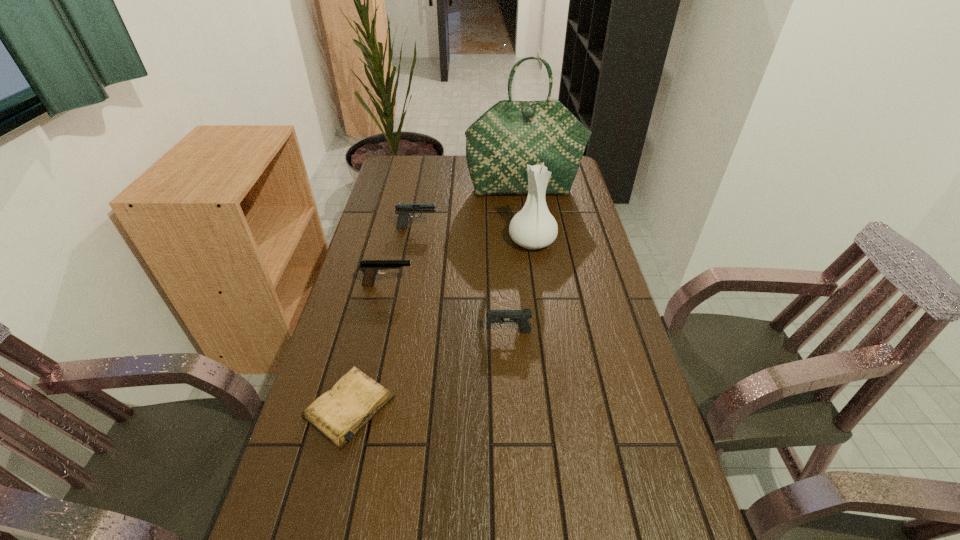
Locate an element on the screen. The image size is (960, 540). vacant space located on the back of the second tallest object is located at coordinates pyautogui.click(x=526, y=201).

Locate an element on the screen. The height and width of the screenshot is (540, 960). free space located aim along the barrel of the farthest pistol is located at coordinates (499, 227).

I want to click on vacant space situated 0.200m at the muzzle of the second farthest pistol, so click(x=481, y=285).

You are a GUI agent. You are given a task and a screenshot of the screen. Output one action in this format:
    pyautogui.click(x=<x>, y=<y>)
    Task: Click on the vacant area located 0.370m at the barrel of the rightmost pistol
    
    Given the screenshot: What is the action you would take?
    pyautogui.click(x=349, y=332)

You are a GUI agent. You are given a task and a screenshot of the screen. Output one action in this format:
    pyautogui.click(x=<x>, y=<y>)
    Task: Click on the free spot located at the barrel of the rightmost pistol
    The width and height of the screenshot is (960, 540).
    Given the screenshot: What is the action you would take?
    pyautogui.click(x=372, y=332)

At what (x,y) coordinates should I click in order to perform the action: click on free location located at the barrel of the rightmost pistol. Please return your answer as a coordinate pair (x, y). Image resolution: width=960 pixels, height=540 pixels. Looking at the image, I should click on point(346,332).

At what (x,y) coordinates should I click in order to perform the action: click on blank space located on the back of the nearest object. Please return your answer as a coordinate pair (x, y). Looking at the image, I should click on (374, 306).

Find the location of a particular element. object located in the far edge section of the desktop is located at coordinates (510, 135).

Locate an element on the screen. The height and width of the screenshot is (540, 960). diary that is at the left edge is located at coordinates (338, 414).

Find the location of a particular element. tote bag that is at the right edge is located at coordinates (510, 135).